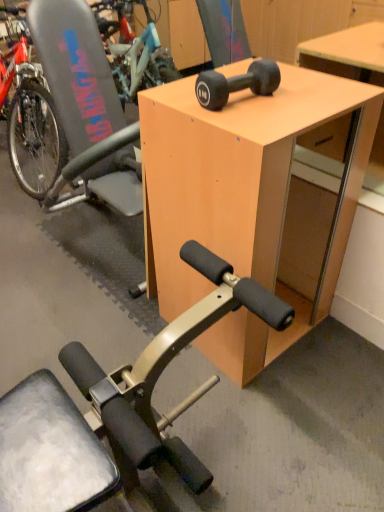
Question: Based on their positions, is black rubber dumbbell at upper center located to the left or right of gray plastic swivel chair at left?

Choices:
 (A) left
 (B) right

Answer: (B)

Question: Is black rubber dumbbell at upper center wider or thinner than gray plastic swivel chair at left?

Choices:
 (A) wide
 (B) thin

Answer: (B)

Question: Estimate the real-world distances between objects in this image. Which object is closer to the gray plastic swivel chair at left?

Choices:
 (A) light wood desk at center
 (B) black rubber dumbbell at upper center

Answer: (A)

Question: Based on their relative distances, which object is farther from the black rubber dumbbell at upper center?

Choices:
 (A) light wood desk at center
 (B) gray plastic swivel chair at left

Answer: (B)